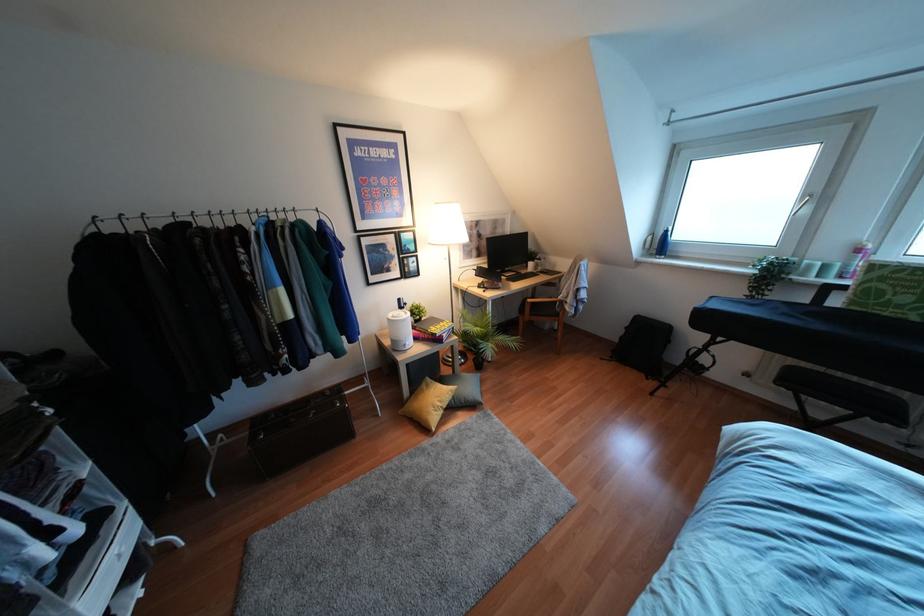
Find where to sit the bench sitting surface. Please return your answer as a coordinate pair (x, y).

(841, 398)